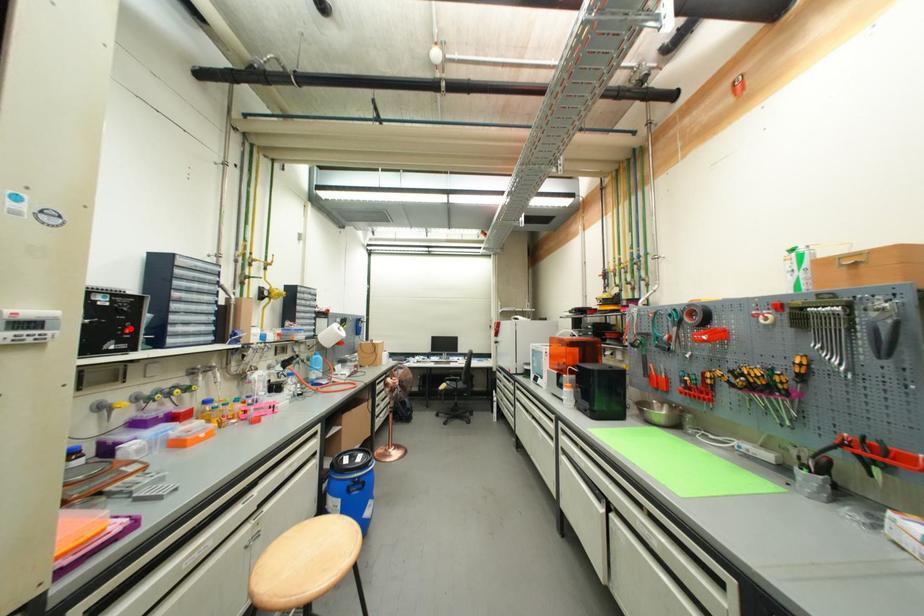
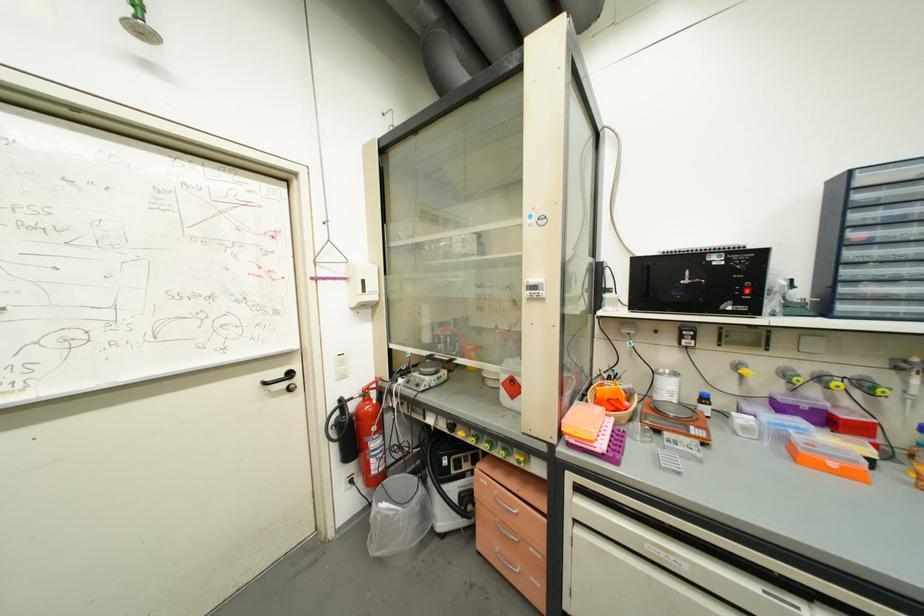
The point at the highlighted location is marked in the first image. Where is the corresponding point in the second image?

(748, 288)